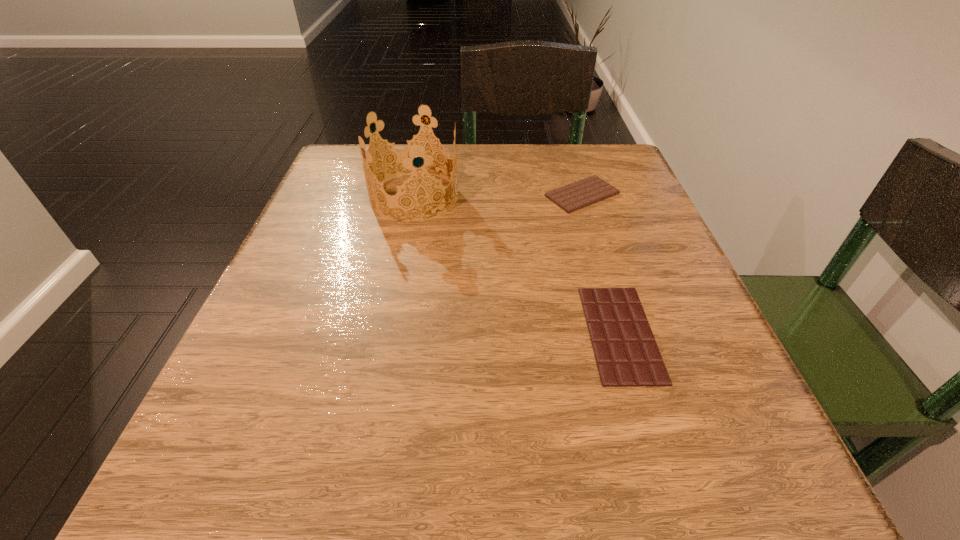
Find the location of a particular element. This screenshot has width=960, height=540. the tallest object is located at coordinates (408, 152).

Locate an element on the screen. The height and width of the screenshot is (540, 960). crown is located at coordinates (408, 152).

This screenshot has height=540, width=960. I want to click on the second tallest object, so click(580, 194).

I want to click on the farther chocolate bar, so click(x=580, y=194).

Identify the location of the nearer chocolate bar. The width and height of the screenshot is (960, 540). (627, 355).

Find the location of a particular element. the shorter chocolate bar is located at coordinates (627, 355).

Locate an element on the screen. The image size is (960, 540). vacant space located 0.220m on the right of the leftmost object is located at coordinates (566, 196).

Identify the location of free region located on the back of the taller chocolate bar. (568, 150).

Find the location of `blank space located 0.320m on the left of the nearest object`. blank space located 0.320m on the left of the nearest object is located at coordinates (367, 333).

This screenshot has height=540, width=960. Identify the location of crown that is at the far edge. (408, 152).